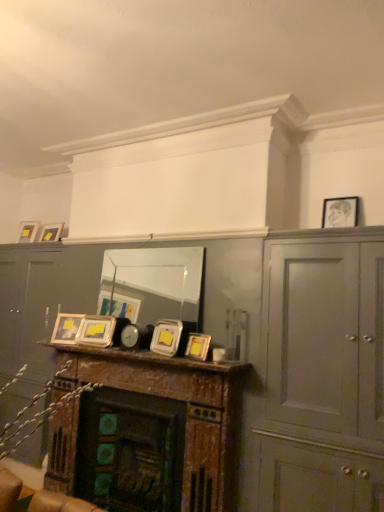
Question: Is metallic silver frames at center in front of matte gold picture frame at upper left, arranged as the sixth picture frame when viewed from the front?

Choices:
 (A) yes
 (B) no

Answer: (A)

Question: Does metallic silver frames at center have a greater height compared to matte gold picture frame at upper left, the sixth picture frame in the right-to-left sequence?

Choices:
 (A) yes
 (B) no

Answer: (B)

Question: Is metallic silver frames at center not near matte gold picture frame at upper left, the sixth picture frame in the right-to-left sequence?

Choices:
 (A) yes
 (B) no

Answer: (A)

Question: Can you see metallic silver frames at center touching matte gold picture frame at upper left, arranged as the sixth picture frame when viewed from the front?

Choices:
 (A) yes
 (B) no

Answer: (B)

Question: From the image's perspective, is metallic silver frames at center under matte gold picture frame at upper left, placed as the 1th picture frame when sorted from left to right?

Choices:
 (A) yes
 (B) no

Answer: (A)

Question: From the image's perspective, is metallic silver picture frame at center, which is counted as the 2th picture frame, starting from the front, positioned above or below matte gray cabinet at right?

Choices:
 (A) below
 (B) above

Answer: (B)

Question: Based on their sizes in the image, would you say metallic silver picture frame at center, which is the fourth picture frame in bottom-to-top order, is bigger or smaller than matte gray cabinet at right?

Choices:
 (A) small
 (B) big

Answer: (A)

Question: Considering the positions of metallic silver picture frame at center, which is counted as the 2th picture frame, starting from the front, and matte gray cabinet at right in the image, is metallic silver picture frame at center, which is counted as the 2th picture frame, starting from the front, taller or shorter than matte gray cabinet at right?

Choices:
 (A) short
 (B) tall

Answer: (A)

Question: Is metallic silver picture frame at center, positioned as the third picture frame in right-to-left order, wider or thinner than matte gray cabinet at right?

Choices:
 (A) wide
 (B) thin

Answer: (B)

Question: Would you say metallic silver frames at center is to the left or to the right of matte gray cabinet at right in the picture?

Choices:
 (A) left
 (B) right

Answer: (A)

Question: Considering the positions of point (56, 345) and point (377, 329), is point (56, 345) closer or farther from the camera than point (377, 329)?

Choices:
 (A) closer
 (B) farther

Answer: (B)

Question: From the image's perspective, is metallic silver frames at center above or below matte gray cabinet at right?

Choices:
 (A) above
 (B) below

Answer: (A)

Question: Is metallic silver frames at center taller or shorter than matte gray cabinet at right?

Choices:
 (A) tall
 (B) short

Answer: (B)

Question: From a real-world perspective, is matte gray cabinet at right above or below matte silver picture frame at center, positioned as the second picture frame in left-to-right order?

Choices:
 (A) below
 (B) above

Answer: (A)

Question: Considering the positions of matte gray cabinet at right and matte silver picture frame at center, positioned as the second picture frame in left-to-right order, in the image, is matte gray cabinet at right taller or shorter than matte silver picture frame at center, positioned as the second picture frame in left-to-right order,?

Choices:
 (A) short
 (B) tall

Answer: (B)